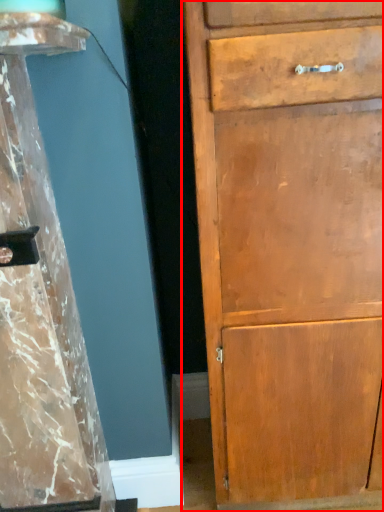
Question: In this image, where is chest of drawers (annotated by the red box) located relative to pillar?

Choices:
 (A) left
 (B) right

Answer: (B)